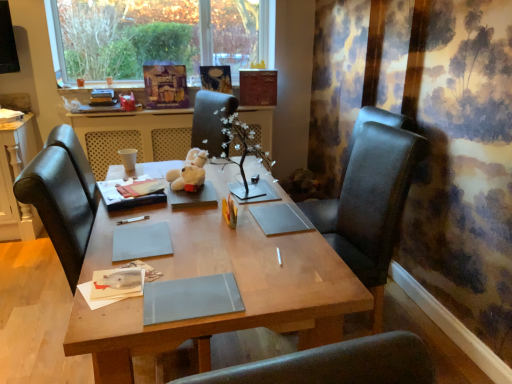
Where is `free space behind matte gray notebook at center, which is the 1th notebook in right-to-left order`? Image resolution: width=512 pixels, height=384 pixels. free space behind matte gray notebook at center, which is the 1th notebook in right-to-left order is located at coordinates (212, 252).